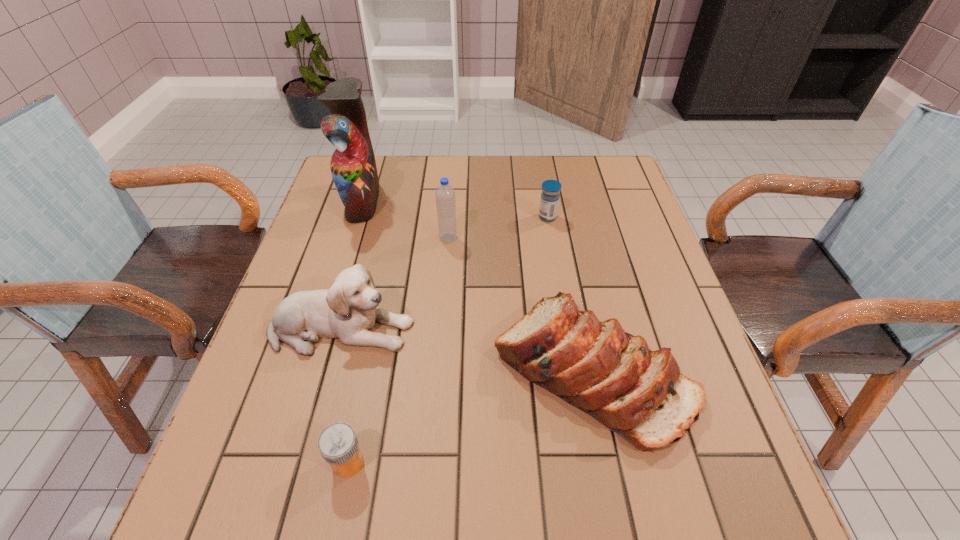
You are a GUI agent. You are given a task and a screenshot of the screen. Output one action in this format:
    pyautogui.click(x=<x>, y=<y>)
    Task: Click on the unoccupied area between the parrot and the third object from right to left
    
    Given the screenshot: What is the action you would take?
    pyautogui.click(x=405, y=219)

The height and width of the screenshot is (540, 960). Find the location of `free space between the third object from right to left and the farther medicine`. free space between the third object from right to left and the farther medicine is located at coordinates point(498,227).

Locate an element on the screen. The height and width of the screenshot is (540, 960). free area in between the fourth nearest object and the puppy is located at coordinates (395, 284).

What are the coordinates of `empty space between the farther medicine and the shorter medicine` in the screenshot? It's located at (447, 340).

Find the location of a particular element. vacant region between the shortest object and the bread is located at coordinates (470, 417).

Choose which object is the fifth nearest neighbor to the tallest object. Please provide its 2D coordinates. Your answer should be formatted as a tuple, i.e. [(x, y)], where the tuple contains the x and y coordinates of a point satisfying the conditions above.

[(338, 444)]

The height and width of the screenshot is (540, 960). I want to click on object that is the second closest to the third shortest object, so click(x=338, y=444).

Image resolution: width=960 pixels, height=540 pixels. Identify the location of vacant point that satisfies the following two spatial constraints: 1. on the back side of the fourth nearest object; 2. at the face of the tallest object. (451, 200).

Locate an element on the screen. Image resolution: width=960 pixels, height=540 pixels. vacant area in the image that satisfies the following two spatial constraints: 1. on the front-facing side of the puppy; 2. on the back side of the third shortest object is located at coordinates (330, 372).

Image resolution: width=960 pixels, height=540 pixels. In order to click on free spot that satisfies the following two spatial constraints: 1. at the face of the parrot; 2. on the right side of the fourth object from left to right in this screenshot , I will do `click(350, 238)`.